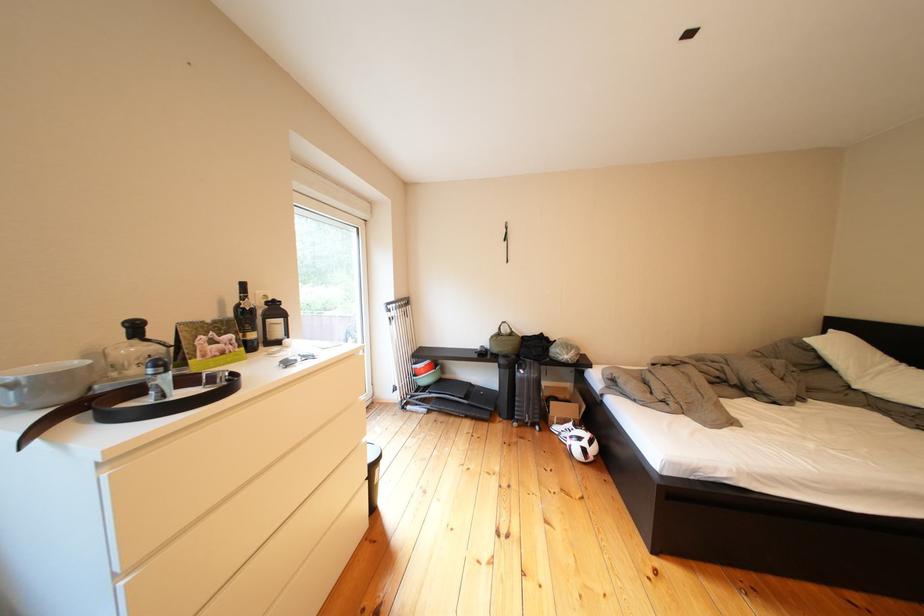
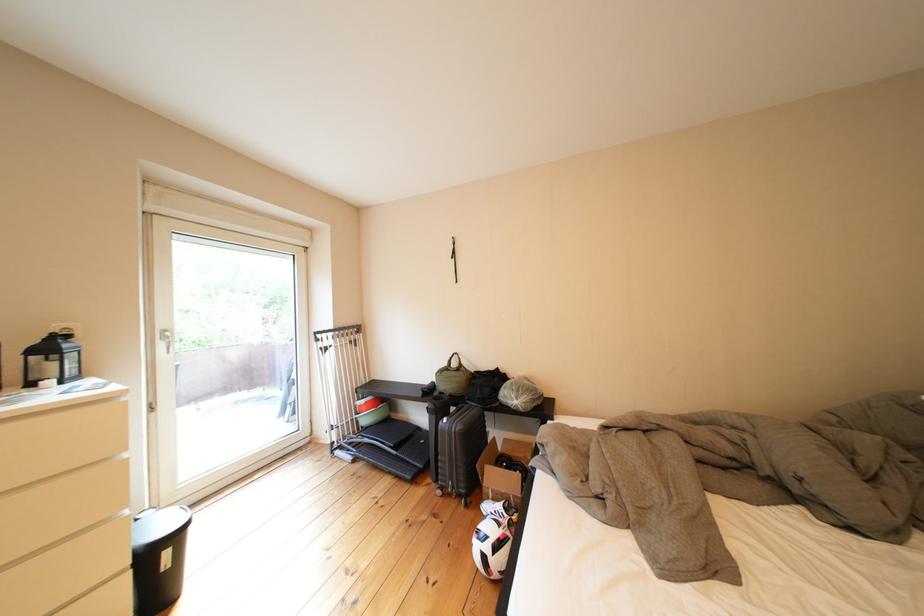
In the second image, find the point that corresponds to (x=599, y=455) in the first image.

(499, 562)